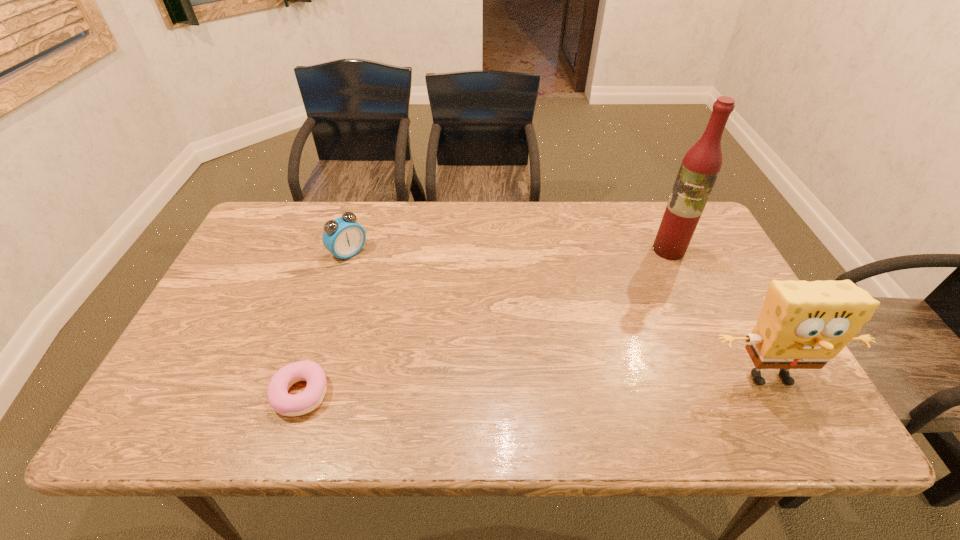
You are a GUI agent. You are given a task and a screenshot of the screen. Output one action in this format:
    pyautogui.click(x=<x>, y=<y>)
    Task: Click on the free spot between the second tallest object and the second shortest object
    The width and height of the screenshot is (960, 540).
    Given the screenshot: What is the action you would take?
    pyautogui.click(x=559, y=315)

At what (x,y) coordinates should I click in order to perform the action: click on free spot between the shortest object and the second tallest object. Please return your answer as a coordinate pair (x, y). Looking at the image, I should click on (535, 385).

Find the location of a particular element. Image resolution: width=960 pixels, height=540 pixels. vacant space that's between the sponge and the liquor is located at coordinates (719, 313).

Image resolution: width=960 pixels, height=540 pixels. Find the location of `free spot between the sponge and the liquor`. free spot between the sponge and the liquor is located at coordinates (719, 313).

What are the coordinates of `object that stands as the closest to the sponge` in the screenshot? It's located at (700, 167).

Select which object appears as the closest to the alarm clock. Please provide its 2D coordinates. Your answer should be formatted as a tuple, i.e. [(x, y)], where the tuple contains the x and y coordinates of a point satisfying the conditions above.

[(283, 403)]

Where is `free space that satisfies the following two spatial constraints: 1. on the back side of the tallest object; 2. on the right side of the second shortest object`? free space that satisfies the following two spatial constraints: 1. on the back side of the tallest object; 2. on the right side of the second shortest object is located at coordinates (349, 250).